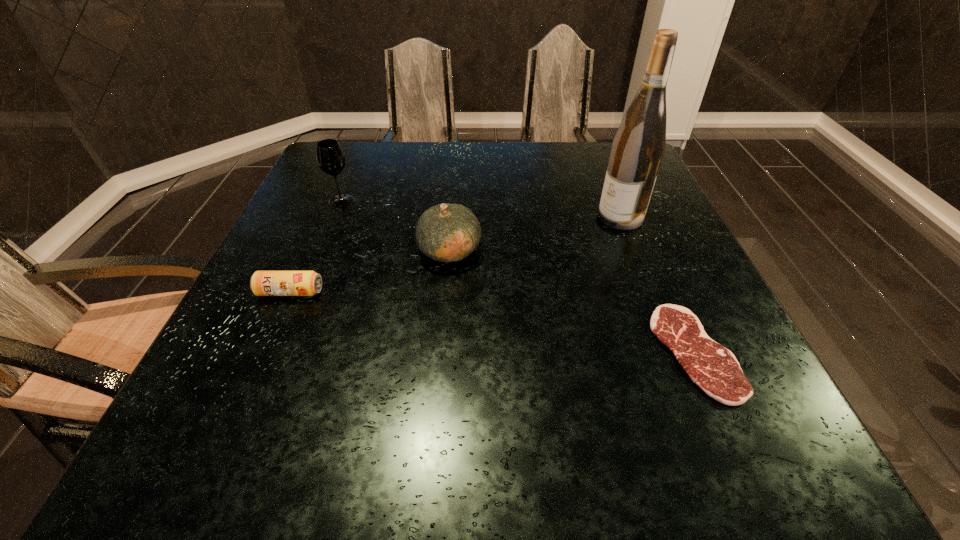
Select which object appears as the closest to the wineglass. Please provide its 2D coordinates. Your answer should be formatted as a tuple, i.e. [(x, y)], where the tuple contains the x and y coordinates of a point satisfying the conditions above.

[(446, 232)]

Where is `vacant space that satisfies the following two spatial constraints: 1. on the front side of the third object from left to right; 2. on the right side of the steak`? Image resolution: width=960 pixels, height=540 pixels. vacant space that satisfies the following two spatial constraints: 1. on the front side of the third object from left to right; 2. on the right side of the steak is located at coordinates (442, 352).

Image resolution: width=960 pixels, height=540 pixels. Find the location of `blank area in the image that satisfies the following two spatial constraints: 1. on the front side of the third object from right to left; 2. on the right side of the nearest object`. blank area in the image that satisfies the following two spatial constraints: 1. on the front side of the third object from right to left; 2. on the right side of the nearest object is located at coordinates (442, 352).